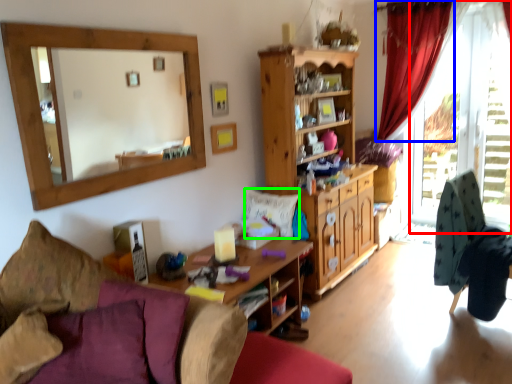
Question: Which object is the closest to the window frame (highlighted by a red box)? Choose among these: curtain (highlighted by a blue box) or pillow (highlighted by a green box).

Choices:
 (A) curtain
 (B) pillow

Answer: (A)